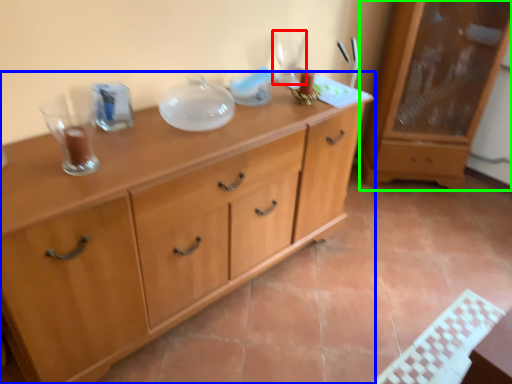
Question: Considering the real-world distances, which object is farthest from wine glass (highlighted by a red box)? chest of drawers (highlighted by a blue box) or cabinetry (highlighted by a green box)?

Choices:
 (A) chest of drawers
 (B) cabinetry

Answer: (B)